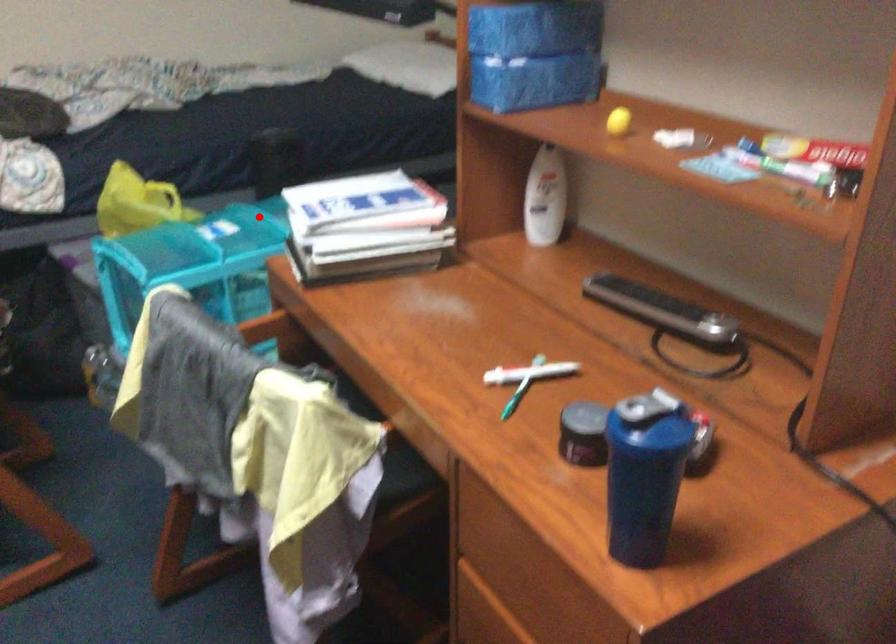
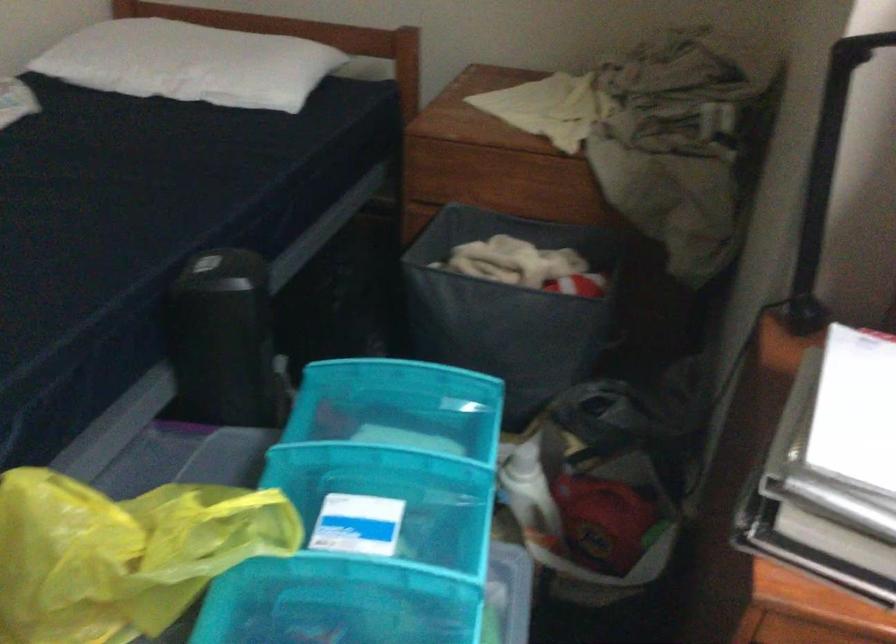
The point at the highlighted location is marked in the first image. Where is the corresponding point in the second image?

(376, 451)